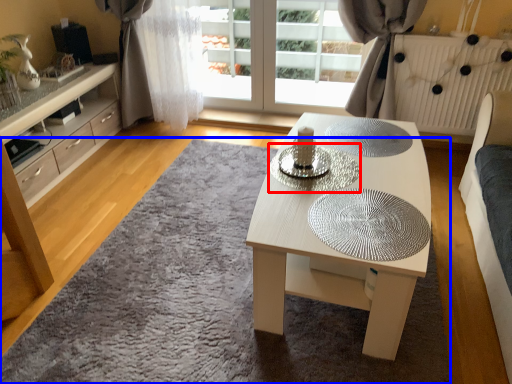
Question: Which object is closer to the camera taking this photo, glass plate (highlighted by a red box) or mat (highlighted by a blue box)?

Choices:
 (A) glass plate
 (B) mat

Answer: (B)